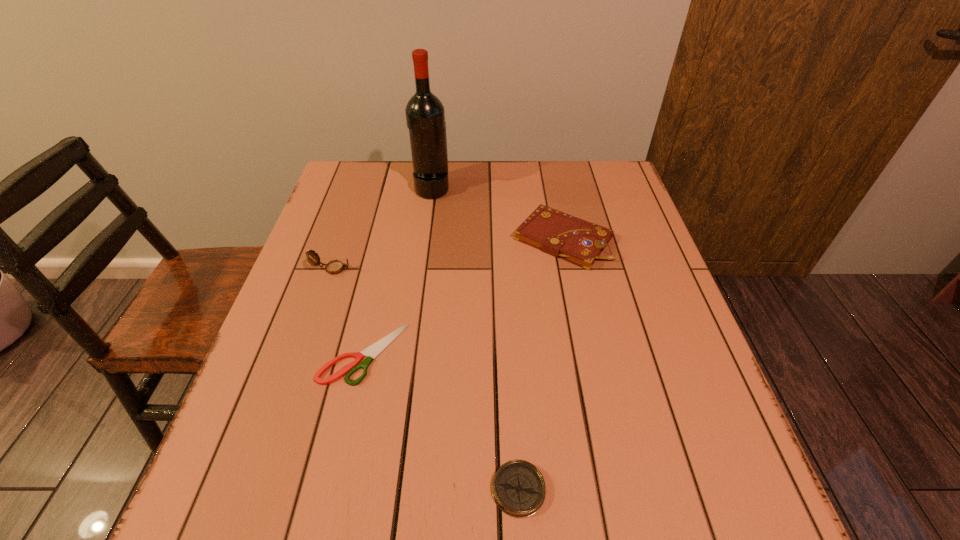
You are a GUI agent. You are given a task and a screenshot of the screen. Output one action in this format:
    pyautogui.click(x=<x>, y=<y>)
    Task: Click on the empty space between the farther compass and the scissors
    
    Given the screenshot: What is the action you would take?
    pyautogui.click(x=348, y=311)

At what (x,y) coordinates should I click in order to perform the action: click on free area in between the left compass and the nearest object. Please return your answer as a coordinate pair (x, y). This screenshot has width=960, height=540. Looking at the image, I should click on (425, 379).

Where is `blank region between the nearer compass and the shortest object`? blank region between the nearer compass and the shortest object is located at coordinates (442, 421).

Locate an element on the screen. free space between the notebook and the farther compass is located at coordinates (447, 254).

What are the coordinates of `vacant point located between the wine bottle and the shortest object` in the screenshot? It's located at (398, 271).

Where is `empty location between the shortest object and the farthest object`? empty location between the shortest object and the farthest object is located at coordinates (398, 271).

The width and height of the screenshot is (960, 540). Find the location of `free space between the notebook and the nearer compass`. free space between the notebook and the nearer compass is located at coordinates (540, 364).

The height and width of the screenshot is (540, 960). What are the coordinates of `the third closest object to the fourth tallest object` in the screenshot? It's located at (334, 267).

The height and width of the screenshot is (540, 960). I want to click on the third closest object relative to the notebook, so click(x=334, y=267).

Find the location of `vacant space that satisfies the following two spatial constraints: 1. on the face of the farther compass; 2. on the left side of the shortest object`. vacant space that satisfies the following two spatial constraints: 1. on the face of the farther compass; 2. on the left side of the shortest object is located at coordinates (303, 354).